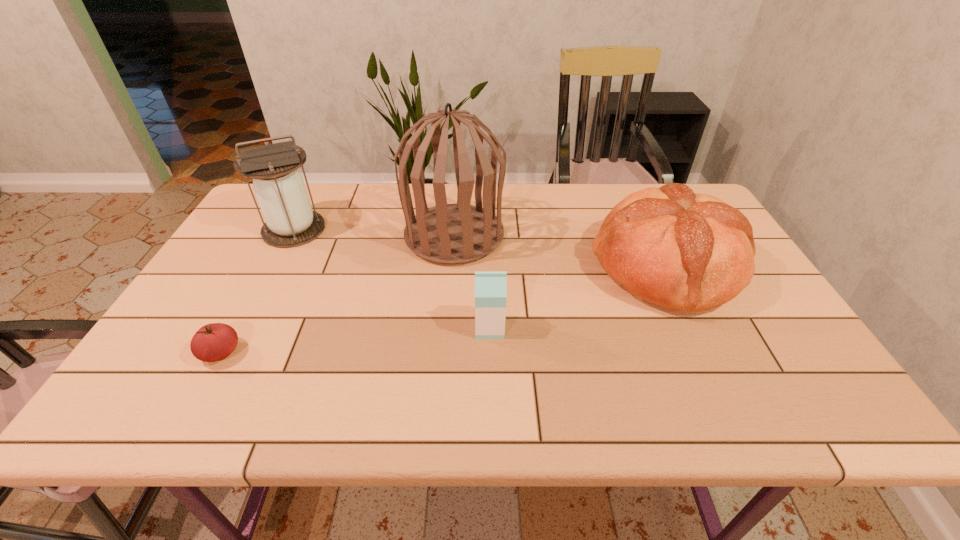
Where is `free space at the left edge of the desktop`? free space at the left edge of the desktop is located at coordinates (257, 246).

Locate an element on the screen. The width and height of the screenshot is (960, 540). free area in between the milk carton and the lantern is located at coordinates (392, 279).

In order to click on vacant area that lies between the birdcage and the fourth shortest object in this screenshot , I will do `click(374, 233)`.

The width and height of the screenshot is (960, 540). In order to click on vacant space in between the shortest object and the tallest object in this screenshot , I will do `click(338, 294)`.

I want to click on free space between the fourth shortest object and the shortest object, so click(257, 291).

Where is `blank region between the birdcage and the fourth tallest object`? This screenshot has width=960, height=540. blank region between the birdcage and the fourth tallest object is located at coordinates (472, 282).

Locate an element on the screen. Image resolution: width=960 pixels, height=540 pixels. vacant point located between the lantern and the tomato is located at coordinates (257, 291).

I want to click on unoccupied area between the shortest object and the fourth tallest object, so click(355, 340).

Image resolution: width=960 pixels, height=540 pixels. Identify the location of empty space that is in between the shortest object and the bread. (444, 310).

In order to click on free space between the milk carton and the birdcage in this screenshot , I will do pos(472,282).